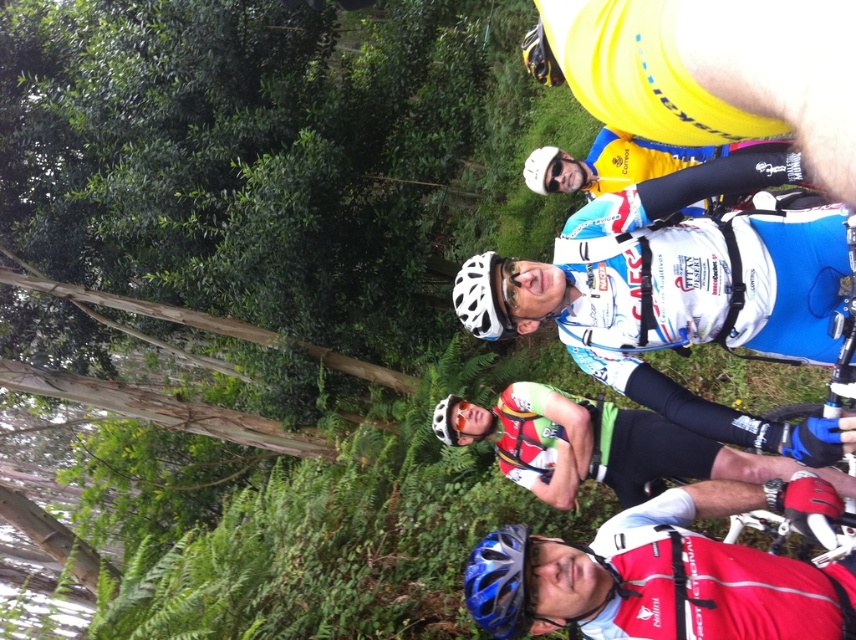
You are a photographer standing at the center of the scene. You want to take a photo of both point (498,532) and point (504,259). Which point should you focus on first to ensure both are in focus?

You should focus on point (504,259) first because it is farther away from the viewer than point (498,532). By focusing on the farther point, the depth of field will naturally include the closer point as well.

You are a photographer trying to capture a photo of the cyclists. You notice two helmets in the scene. Which helmet is positioned lower between the blue matte helmet at lower center and the white matte bicycle helmet at center?

The blue matte helmet at lower center is positioned below the white matte bicycle helmet at center, so it is lower in the scene.